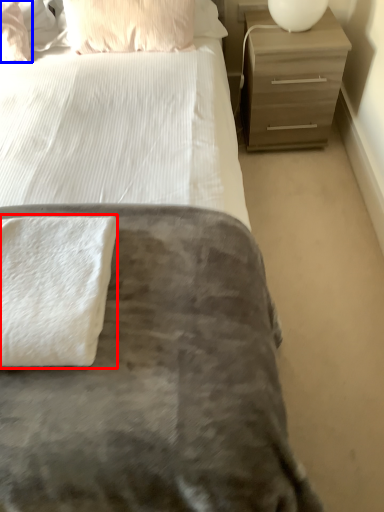
Question: Which point is further to the camera, bath towel (highlighted by a red box) or pillow (highlighted by a blue box)?

Choices:
 (A) bath towel
 (B) pillow

Answer: (B)